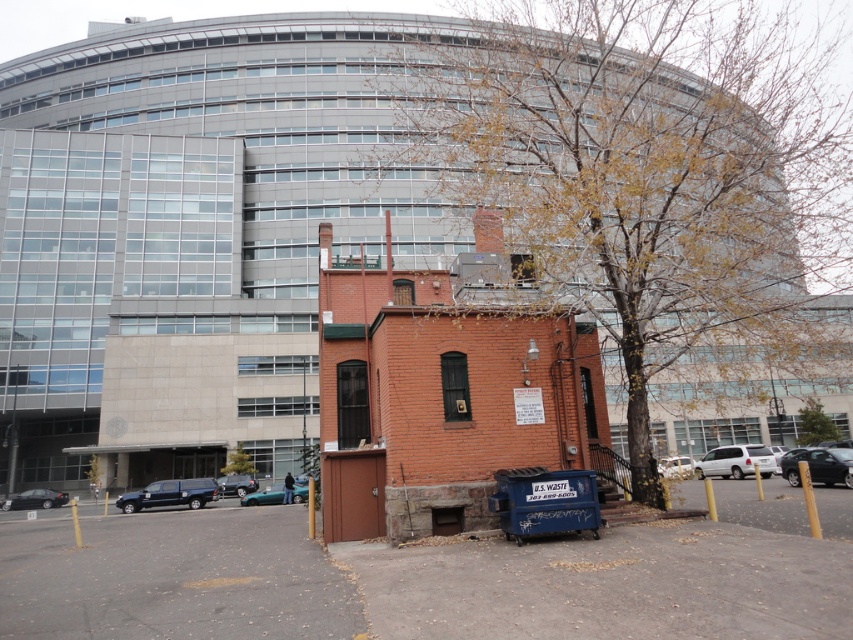
You are a delivery driver who needs to park your vehicle between the metallic blue truck at lower left and the shiny black sedan at center. Considering their heights, which vehicle should you park closer to in order to avoid hitting the low hanging branches above the parking spot?

The metallic blue truck at lower left is taller than the shiny black sedan at center, so you should park closer to the shiny black sedan at center to avoid hitting the low hanging branches above the parking spot since it is shorter.

You are a delivery driver who needs to park your truck between the black glossy sedan at lower left and the teal matte car at center. Your truck is 12 meters long. Can you fit your truck between them?

The distance between the black glossy sedan at lower left and the teal matte car at center is 14.39 meters. Since your truck is 12 meters long, there is enough space to park between them.

You are a delivery person who needs to park your teal matte car at center between the white matte van at center and the red brick building. Is it possible to do so?

The white matte van at center is to the right of the teal matte car at center, so there is space between the teal matte car at center and the red brick building to park.